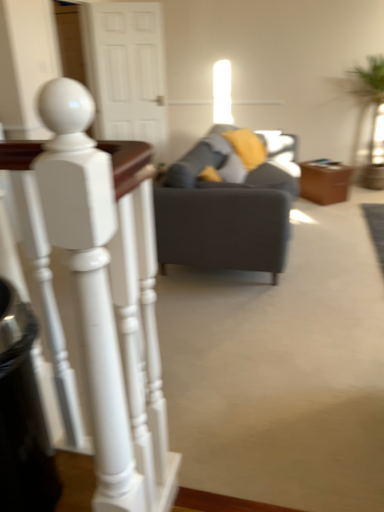
You are a GUI agent. You are given a task and a screenshot of the screen. Output one action in this format:
    pyautogui.click(x=<x>, y=<y>)
    Task: Click on the gray fabric swivel chair at center
    The width and height of the screenshot is (384, 512).
    Given the screenshot: What is the action you would take?
    pyautogui.click(x=239, y=160)

Locate an element on the screen. The image size is (384, 512). white glossy staircase railing at left is located at coordinates (104, 310).

Describe the element at coordinates (367, 89) in the screenshot. This screenshot has height=512, width=384. I see `green leafy plant at right` at that location.

Measure the distance between green leafy plant at right and camera.

green leafy plant at right is 5.64 meters from camera.

What is the approximate width of matte gray couch at center?

3.49 feet.

I want to click on white wood door at upper center, so click(x=126, y=71).

Locate an element on the screen. This screenshot has width=384, height=512. brown leather side table at center is located at coordinates (324, 181).

Considering the positions of objects gray fabric swivel chair at center and white glossy staircase railing at left in the image provided, who is in front, gray fabric swivel chair at center or white glossy staircase railing at left?

Positioned in front is white glossy staircase railing at left.

Considering the relative positions of gray fabric swivel chair at center and white glossy staircase railing at left in the image provided, is gray fabric swivel chair at center to the right of white glossy staircase railing at left from the viewer's perspective?

Yes.

Is gray fabric swivel chair at center positioned far away from white glossy staircase railing at left?

Indeed, gray fabric swivel chair at center is not near white glossy staircase railing at left.

Is gray fabric swivel chair at center completely or partially outside of white glossy staircase railing at left?

Yes.

In the scene shown: Are black plastic trash can at lower left and gray fabric swivel chair at center far apart?

black plastic trash can at lower left is positioned a significant distance from gray fabric swivel chair at center.

Where is `swivel chair beneath the black plastic trash can at lower left (from a real-world perspective)`? The height and width of the screenshot is (512, 384). swivel chair beneath the black plastic trash can at lower left (from a real-world perspective) is located at coordinates (239, 160).

Considering the relative sizes of black plastic trash can at lower left and gray fabric swivel chair at center in the image provided, is black plastic trash can at lower left thinner than gray fabric swivel chair at center?

Yes, black plastic trash can at lower left is thinner than gray fabric swivel chair at center.

Does point (8, 296) come farther from viewer compared to point (268, 144)?

No.

Is black plastic trash can at lower left to the right of white glossy staircase railing at left from the viewer's perspective?

Incorrect, black plastic trash can at lower left is not on the right side of white glossy staircase railing at left.

Is point (15, 390) positioned before point (108, 311)?

No, it is not.

From the image's perspective, is black plastic trash can at lower left on white glossy staircase railing at left?

No, from the image's perspective, black plastic trash can at lower left is not above white glossy staircase railing at left.

Based on the photo, is black plastic trash can at lower left next to white glossy staircase railing at left and touching it?

No, black plastic trash can at lower left is not next to white glossy staircase railing at left.

Is brown leather side table at center surrounding black plastic trash can at lower left?

Definitely not — black plastic trash can at lower left is not inside brown leather side table at center.

Between point (337, 162) and point (38, 472), which one is positioned behind?

Point (337, 162)

From the picture: From a real-world perspective, is brown leather side table at center beneath black plastic trash can at lower left?

Indeed, from a real-world perspective, brown leather side table at center is positioned beneath black plastic trash can at lower left.

Relative to black plastic trash can at lower left, is white glossy staircase railing at left in front or behind?

white glossy staircase railing at left is positioned closer to the viewer than black plastic trash can at lower left.

Is white glossy staircase railing at left aimed at black plastic trash can at lower left?

Yes, white glossy staircase railing at left is oriented towards black plastic trash can at lower left.

Identify the location of trash bin/can behind the white glossy staircase railing at left. (22, 415).

Which object is wider, white glossy staircase railing at left or black plastic trash can at lower left?

Wider between the two is black plastic trash can at lower left.

Which is in front, point (327, 198) or point (285, 222)?

The point (285, 222) is in front.

From a real-world perspective, is brown leather side table at center located higher than matte gray couch at center?

No, from a real-world perspective, brown leather side table at center is not over matte gray couch at center

Is the depth of brown leather side table at center greater than that of matte gray couch at center?

Yes.

I want to click on studio couch on the left of brown leather side table at center, so click(228, 203).

Which object is thinner, gray fabric swivel chair at center or matte gray couch at center?

gray fabric swivel chair at center is thinner.

Are gray fabric swivel chair at center and matte gray couch at center beside each other?

Yes, gray fabric swivel chair at center is touching matte gray couch at center.

Locate an element on the screen. The width and height of the screenshot is (384, 512). swivel chair located behind the matte gray couch at center is located at coordinates point(239,160).

Considering the sizes of objects gray fabric swivel chair at center and matte gray couch at center in the image provided, who is bigger, gray fabric swivel chair at center or matte gray couch at center?

Bigger between the two is matte gray couch at center.

Identify the location of desk in front of the gray fabric swivel chair at center. (104, 310).

You are a GUI agent. You are given a task and a screenshot of the screen. Output one action in this format:
    pyautogui.click(x=<x>, y=<y>)
    Task: Click on the trash bin/can below the gray fabric swivel chair at center (from the image's perspective)
    The width and height of the screenshot is (384, 512).
    Given the screenshot: What is the action you would take?
    pyautogui.click(x=22, y=415)

When comparing their distances from white wood door at upper center, does black plastic trash can at lower left or brown leather side table at center seem further?

Among the two, black plastic trash can at lower left is located further to white wood door at upper center.

In the scene shown: Which object lies further to the anchor point brown leather side table at center, matte gray couch at center or green leafy plant at right?

green leafy plant at right.

From the image, which object appears to be farther from white wood door at upper center, gray fabric swivel chair at center or white glossy staircase railing at left?

The object further to white wood door at upper center is white glossy staircase railing at left.

From the image, which object appears to be farther from white glossy staircase railing at left, gray fabric swivel chair at center or black plastic trash can at lower left?

gray fabric swivel chair at center is further to white glossy staircase railing at left.

Considering their positions, is white wood door at upper center positioned closer to black plastic trash can at lower left than green leafy plant at right?

white wood door at upper center.

From the image, which object appears to be farther from gray fabric swivel chair at center, white glossy staircase railing at left or black plastic trash can at lower left?

black plastic trash can at lower left is positioned further to the anchor gray fabric swivel chair at center.

Looking at the image, which one is located closer to matte gray couch at center, black plastic trash can at lower left or brown leather side table at center?

brown leather side table at center.

Estimate the real-world distances between objects in this image. Which object is closer to green leafy plant at right, white wood door at upper center or white glossy staircase railing at left?

white wood door at upper center is positioned closer to the anchor green leafy plant at right.

Identify the location of studio couch between black plastic trash can at lower left and gray fabric swivel chair at center in the front-back direction. (228, 203).

Locate an element on the screen. This screenshot has height=512, width=384. trash bin/can between white glossy staircase railing at left and green leafy plant at right from front to back is located at coordinates (22, 415).

Where is `studio couch between white glossy staircase railing at left and green leafy plant at right in the front-back direction`? This screenshot has width=384, height=512. studio couch between white glossy staircase railing at left and green leafy plant at right in the front-back direction is located at coordinates (228, 203).

Locate an element on the screen. swivel chair between black plastic trash can at lower left and green leafy plant at right from front to back is located at coordinates (239, 160).